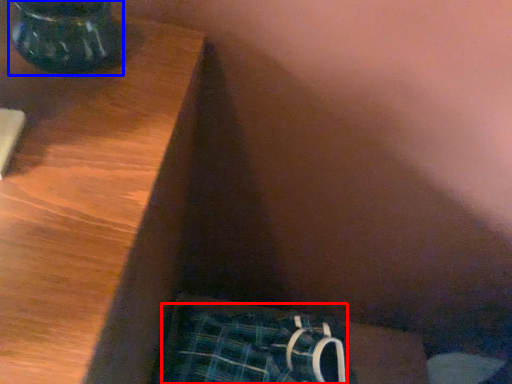
Question: Among these objects, which one is nearest to the camera, underclothes (highlighted by a red box) or vase (highlighted by a blue box)?

Choices:
 (A) underclothes
 (B) vase

Answer: (B)